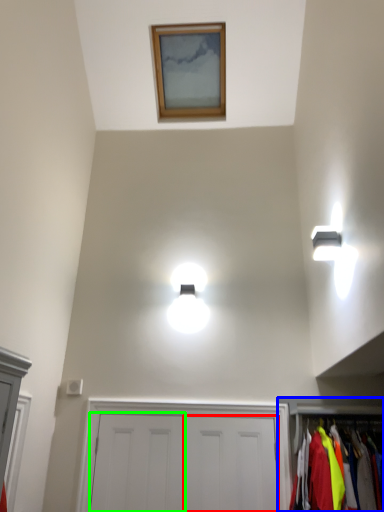
Question: Which object is positioned closest to door (highlighted by a red box)? Select from dresser (highlighted by a blue box) and door (highlighted by a green box).

Choices:
 (A) dresser
 (B) door

Answer: (B)